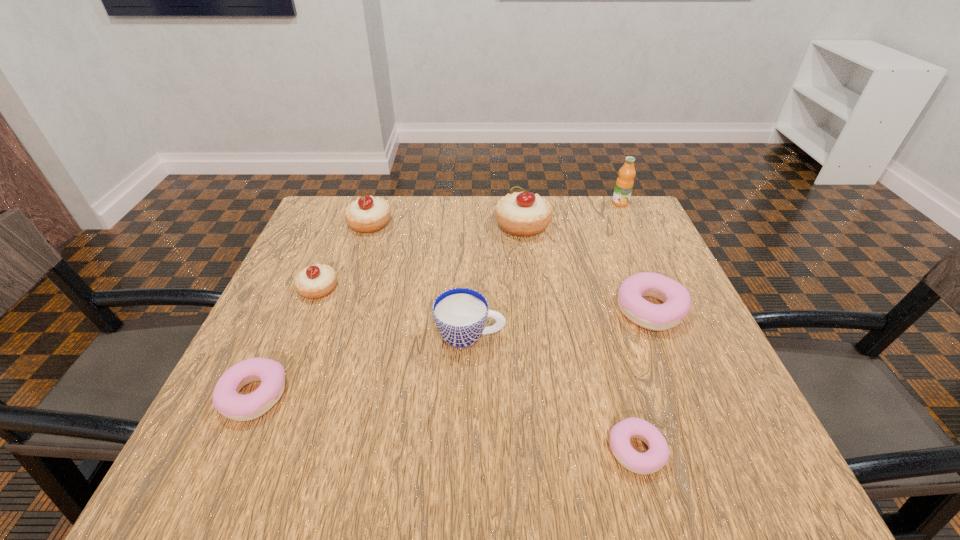
Where is `the tallest object`? This screenshot has height=540, width=960. the tallest object is located at coordinates (624, 184).

The width and height of the screenshot is (960, 540). I want to click on the farthest object, so click(x=624, y=184).

Find the location of a particular element. the rightmost beige pastry is located at coordinates (522, 214).

Identify the location of the fourth pastry from left to right. The width and height of the screenshot is (960, 540). (522, 214).

Where is `the fifth shortest pastry`? The image size is (960, 540). the fifth shortest pastry is located at coordinates (368, 214).

At what (x,y) coordinates should I click in order to perform the action: click on cup. Please return your answer as a coordinate pair (x, y). The width and height of the screenshot is (960, 540). Looking at the image, I should click on (460, 314).

Where is `the nearest beige pastry`? the nearest beige pastry is located at coordinates (316, 281).

Image resolution: width=960 pixels, height=540 pixels. I want to click on the fourth shortest pastry, so click(316, 281).

Locate an element on the screen. The image size is (960, 540). the fourth tallest pastry is located at coordinates (676, 299).

Where is `the sixth tallest object`? This screenshot has height=540, width=960. the sixth tallest object is located at coordinates (676, 299).